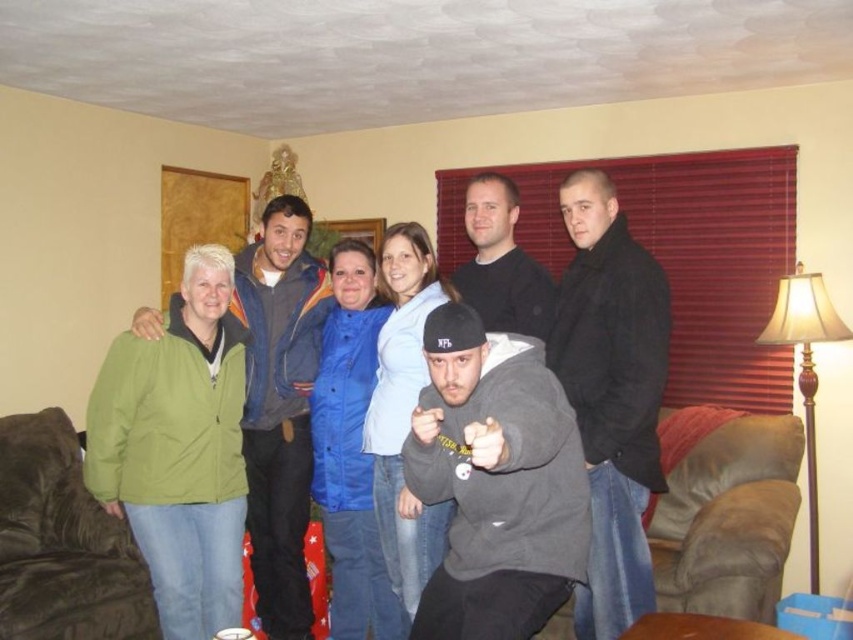
Can you confirm if gray matte hoodie at center is smaller than green matte jacket at left?

Yes.

Is point (509, 372) farther from viewer compared to point (523, 170)?

That is False.

Where is `gray matte hoodie at center`? The width and height of the screenshot is (853, 640). gray matte hoodie at center is located at coordinates (495, 481).